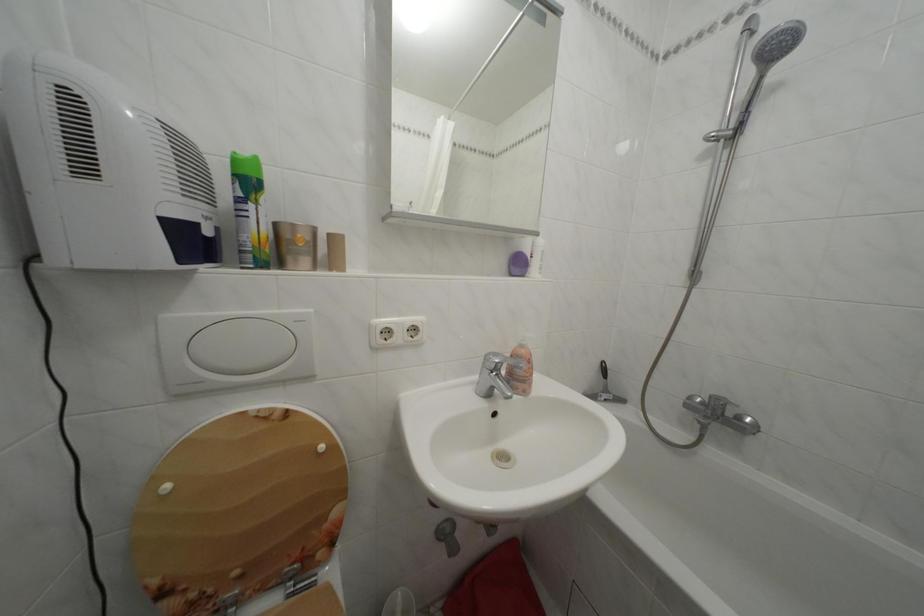
Identify the location of aerosol can nozzle. This screenshot has width=924, height=616. pos(604,389).